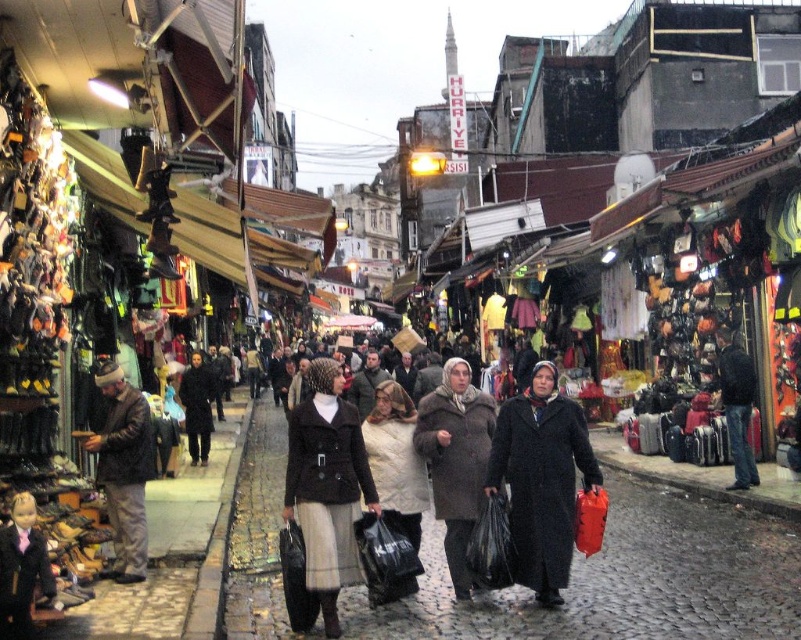
You are standing at the entrance of the market and want to walk to the dark gray cobblestone pavement at center. Which direction should you head?

→ The dark gray cobblestone pavement at center is located at coordinates point [622,580], so you should head towards the center of the image to reach it.